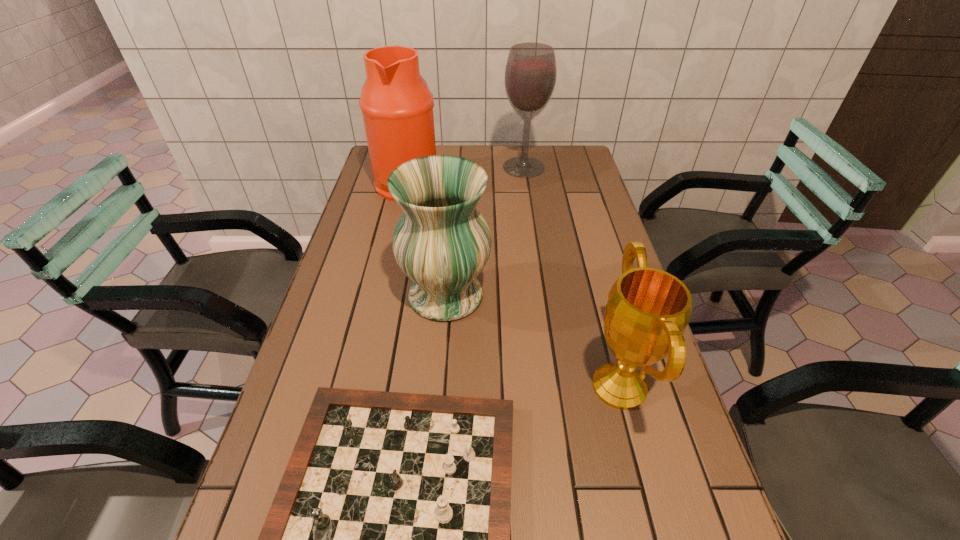
Locate an element on the screen. This screenshot has height=540, width=960. water jug that is at the far edge is located at coordinates (397, 107).

The image size is (960, 540). What are the coordinates of `alcohol that is at the far edge` in the screenshot? It's located at (530, 75).

At what (x,y) coordinates should I click in order to perform the action: click on object present at the left edge. Please return your answer as a coordinate pair (x, y). Looking at the image, I should click on (397, 107).

You are a GUI agent. You are given a task and a screenshot of the screen. Output one action in this format:
    pyautogui.click(x=<x>, y=<y>)
    Task: Click on the alcohol located at the right edge
    
    Given the screenshot: What is the action you would take?
    pyautogui.click(x=530, y=75)

Locate an element on the screen. Image resolution: width=960 pixels, height=540 pixels. award positioned at the right edge is located at coordinates (648, 309).

What are the coordinates of `object positioned at the far left corner` in the screenshot? It's located at (397, 107).

I want to click on object that is positioned at the far right corner, so click(x=530, y=75).

In the image, there is a desktop. Where is `free space at the far edge`? The height and width of the screenshot is (540, 960). free space at the far edge is located at coordinates (497, 146).

This screenshot has width=960, height=540. What are the coordinates of `free region at the left edge of the desktop` in the screenshot? It's located at (358, 231).

Identify the location of vacant area at the right edge. (604, 219).